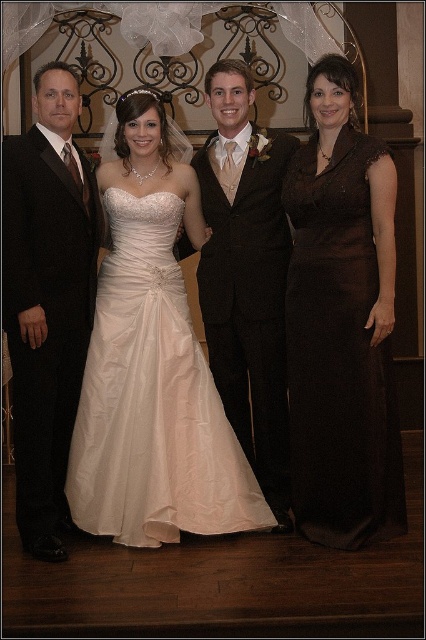
Does ivory satin wedding dress at center appear on the right side of brown satin dress at right?

Incorrect, ivory satin wedding dress at center is not on the right side of brown satin dress at right.

Which of these two, ivory satin wedding dress at center or brown satin dress at right, stands shorter?

With less height is ivory satin wedding dress at center.

What do you see at coordinates (152, 401) in the screenshot? The height and width of the screenshot is (640, 426). I see `ivory satin wedding dress at center` at bounding box center [152, 401].

Locate an element on the screen. This screenshot has width=426, height=640. ivory satin wedding dress at center is located at coordinates click(152, 401).

Is ivory satin wedding dress at center smaller than black satin suit at left?

No.

Is point (221, 428) positioned after point (65, 269)?

That is True.

Identify the location of ivory satin wedding dress at center. The width and height of the screenshot is (426, 640). (152, 401).

Is point (374, 300) farther from viewer compared to point (261, 410)?

No, it is in front of (261, 410).

Is brown satin dress at right positioned behind satin black suit at center?

That is False.

Between point (389, 483) and point (247, 84), which one is positioned in front?

Point (389, 483) is more forward.

Locate an element on the screen. brown satin dress at right is located at coordinates (339, 353).